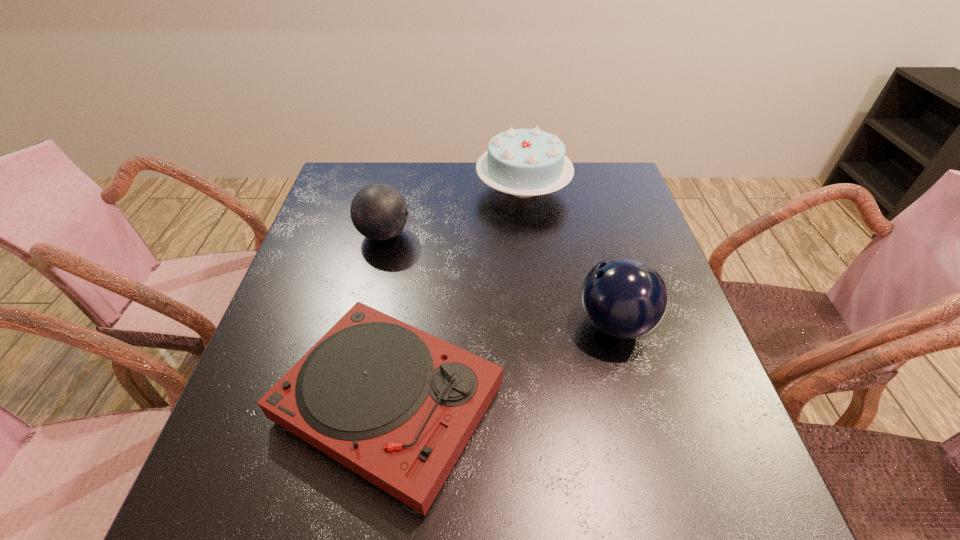
The height and width of the screenshot is (540, 960). In order to click on vacant space located on the grip area of the left bowling ball in this screenshot , I will do 468,234.

Locate an element on the screen. The image size is (960, 540). free region located on the back of the shortest object is located at coordinates (411, 267).

Identify the location of object that is at the far edge. The height and width of the screenshot is (540, 960). (523, 162).

I want to click on object at the near edge, so click(397, 406).

Identify the location of bowling ball situated at the left edge. Image resolution: width=960 pixels, height=540 pixels. (379, 212).

Identify the location of record player present at the left edge. The image size is (960, 540). (397, 406).

Locate an element on the screen. The width and height of the screenshot is (960, 540). object at the right edge is located at coordinates (623, 297).

Where is `object that is at the near left corner`? The width and height of the screenshot is (960, 540). object that is at the near left corner is located at coordinates (397, 406).

The image size is (960, 540). In order to click on vacant space at the far edge of the desktop in this screenshot , I will do `click(474, 166)`.

In order to click on free space at the near edge in this screenshot , I will do `click(343, 476)`.